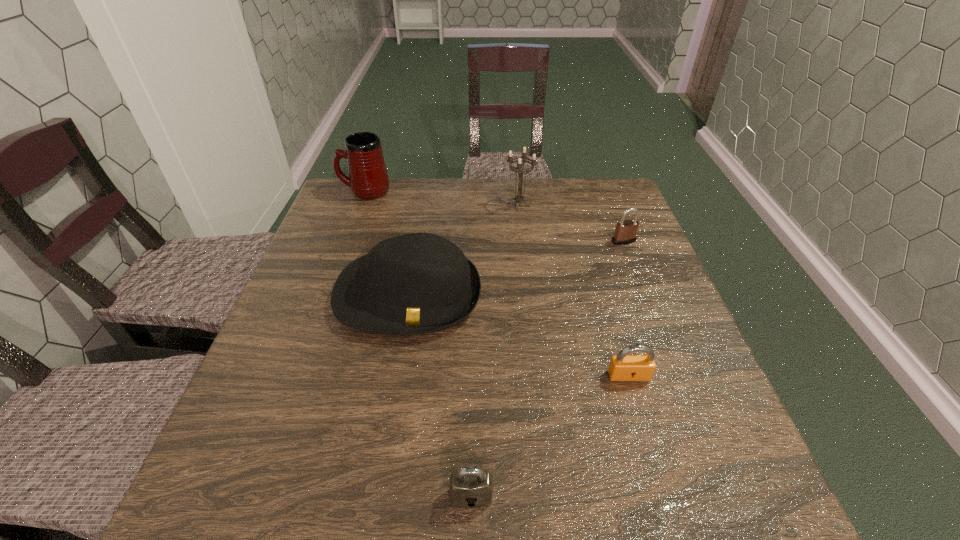
You are a GUI agent. You are given a task and a screenshot of the screen. Output one action in this format:
    pyautogui.click(x=<x>, y=<y>)
    Task: Click on the free region located on the right of the fourth object from left to right
    The width and height of the screenshot is (960, 540).
    Given the screenshot: What is the action you would take?
    point(596,205)

This screenshot has width=960, height=540. Find the location of `free space located on the front-facing side of the third tallest object`. free space located on the front-facing side of the third tallest object is located at coordinates (394, 385).

At what (x,y) coordinates should I click in order to perform the action: click on vacant region located 0.310m on the left of the fourth nearest object. Please return your answer as a coordinate pair (x, y). The height and width of the screenshot is (540, 960). Looking at the image, I should click on (495, 241).

At what (x,y) coordinates should I click in order to perform the action: click on vacant space situated to unlock the second padlock from left to right from the front. Please return your answer as a coordinate pair (x, y). The width and height of the screenshot is (960, 540). Looking at the image, I should click on (643, 424).

You are a GUI agent. You are given a task and a screenshot of the screen. Output one action in this format:
    pyautogui.click(x=<x>, y=<y>)
    Task: Click on the mug that is at the far edge
    
    Given the screenshot: What is the action you would take?
    pyautogui.click(x=368, y=178)

Identify the location of candle holder positioned at the far edge. The width and height of the screenshot is (960, 540). point(519,198).

Locate an element on the screen. object at the near edge is located at coordinates (470, 487).

Where is `mug that is at the left edge`? Image resolution: width=960 pixels, height=540 pixels. mug that is at the left edge is located at coordinates (368, 178).

Identify the location of fedora that is at the left edge. (418, 283).

At what (x,y) coordinates should I click in order to perform the action: click on object that is at the far left corner. Please return your answer as a coordinate pair (x, y). Looking at the image, I should click on (368, 178).